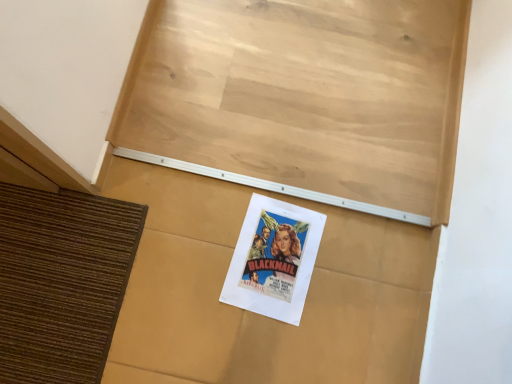
Question: From the image's perspective, is matte paper poster at center positioned above or below white paper poster at center?

Choices:
 (A) below
 (B) above

Answer: (A)

Question: From a real-world perspective, relative to white paper poster at center, is matte paper poster at center vertically above or below?

Choices:
 (A) below
 (B) above

Answer: (A)

Question: Relative to white paper poster at center, is matte paper poster at center in front or behind?

Choices:
 (A) front
 (B) behind

Answer: (B)

Question: Is white paper poster at center situated inside matte paper poster at center or outside?

Choices:
 (A) outside
 (B) inside

Answer: (A)

Question: From their relative heights in the image, would you say white paper poster at center is taller or shorter than matte paper poster at center?

Choices:
 (A) short
 (B) tall

Answer: (B)

Question: Is white paper poster at center bigger or smaller than matte paper poster at center?

Choices:
 (A) big
 (B) small

Answer: (A)

Question: Relative to matte paper poster at center, is white paper poster at center in front or behind?

Choices:
 (A) behind
 (B) front

Answer: (B)